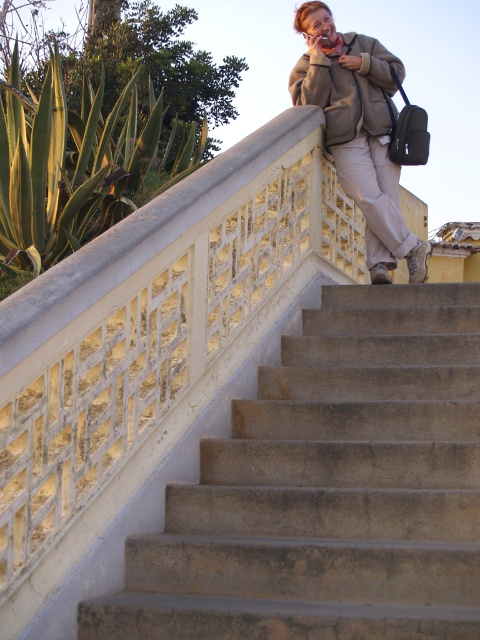
Based on the scene, where is the concrete stairs at center in relation to the matte beige pants at upper center?

The concrete stairs at center are to the left of the matte beige pants at upper center.

You are a delivery person trying to place a small package on the concrete stairs at center. The package is as wide as the matte beige pants at upper center. Will the package fit on the stairs?

The concrete stairs at center might be wider than matte beige pants at upper center, so the package, which is as wide as the matte beige pants at upper center, should fit on the stairs.